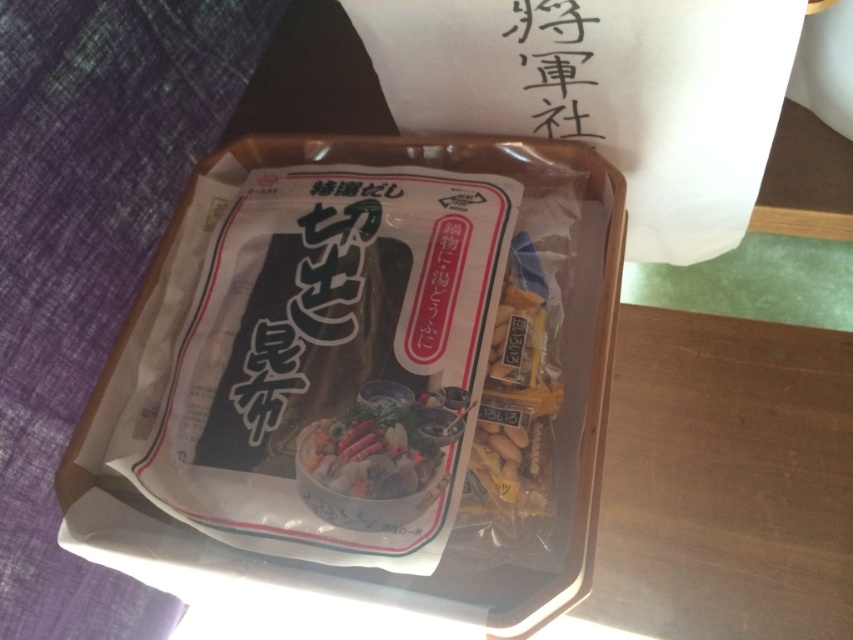
Question: Which point is farther from the camera taking this photo?

Choices:
 (A) (357, 417)
 (B) (459, 420)

Answer: (A)

Question: Which of the following is the closest to the observer?

Choices:
 (A) (252, 388)
 (B) (451, 435)

Answer: (B)

Question: Which of the following is the closest to the observer?

Choices:
 (A) transparent plastic bag of seaweed at center
 (B) shiny plastic food at center

Answer: (A)

Question: Considering the relative positions of transparent plastic bag of seaweed at center and shiny plastic food at center in the image provided, where is transparent plastic bag of seaweed at center located with respect to shiny plastic food at center?

Choices:
 (A) above
 (B) below

Answer: (A)

Question: Is transparent plastic bag of seaweed at center closer to the viewer compared to shiny plastic food at center?

Choices:
 (A) yes
 (B) no

Answer: (A)

Question: Does transparent plastic bag of seaweed at center appear under shiny plastic food at center?

Choices:
 (A) yes
 (B) no

Answer: (B)